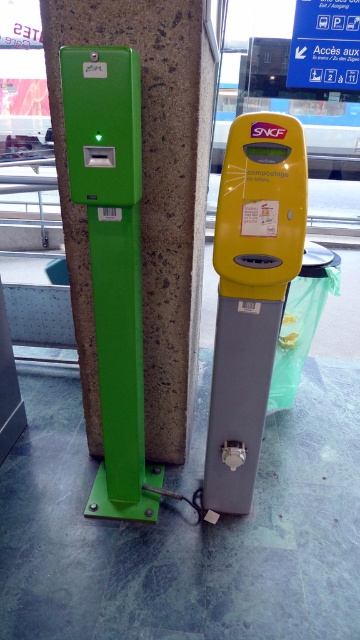
You are a traveler at the train station and need to validate your ticket. The station has a green plastic card reader at left. Where is the green plastic card reader located relative to the pillar?

The green plastic card reader at left is located at point [146,198] relative to the pillar.

You are a traveler holding a train ticket and need to validate it. You see a green plastic card reader at left and a yellow plastic parking meter at center. Which machine should you use for ticket validation?

The yellow plastic parking meter at center is labeled with the text in French for ticket validation, so you should use the yellow plastic parking meter at center.